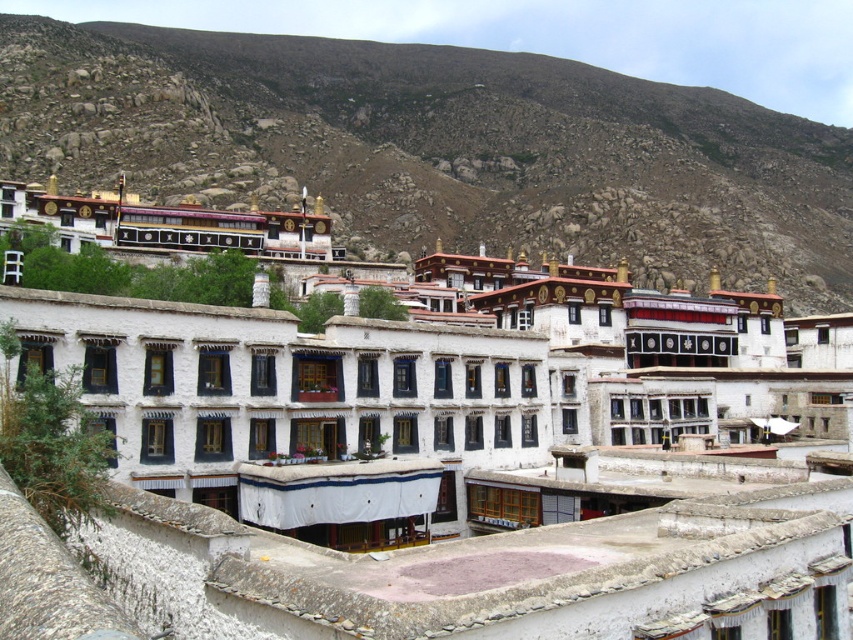
You are standing at the entrance of the Tibetan architectural complex and see a point marked at coordinates (x=419, y=483). Based on the scene description, what does this point most likely represent?

The point at (x=419, y=483) indicates the location of the white stone building at center.

You are standing in front of the Tibetan architectural complex and notice the white stone building at center and the brown rocky hillside at upper center. From your vantage point, which object is positioned to the left of the other?

The white stone building at center is to the left of brown rocky hillside at upper center.

You are a hiker planning to travel from the white stone building at center to the brown rocky hillside at upper center. Given that your average walking pace is 3 miles per hour, how many minutes will it take you to reach the hillside?

The distance between the white stone building at center and the brown rocky hillside at upper center is 573.77 feet. Converting this distance to miles, 573.77 feet equals approximately 0.108 miles. At a walking pace of 3 miles per hour, it would take roughly 2.16 minutes to cover this distance. Therefore, you can expect to reach the hillside in about 2 minutes.